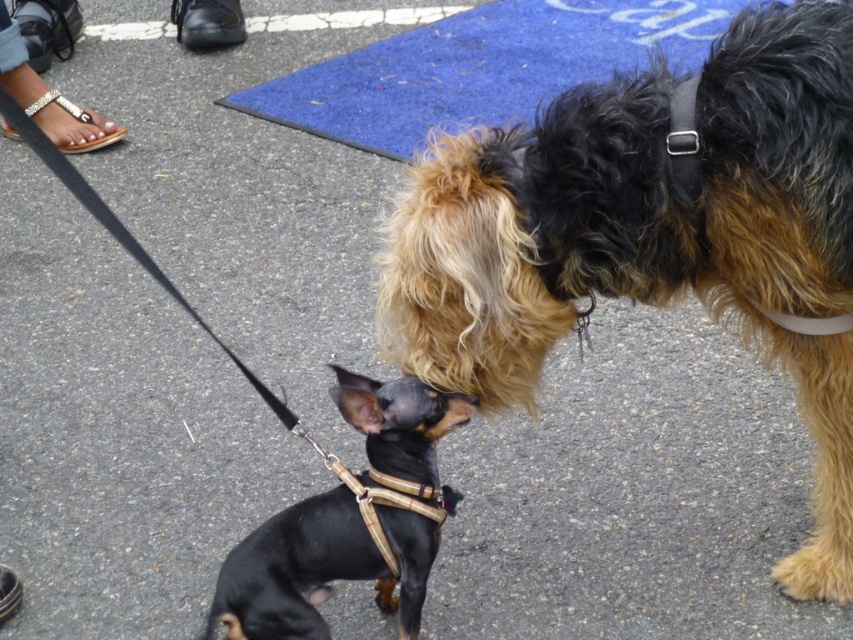
Can you confirm if black and tan fur at center is positioned above black leather harness at center?

Indeed, black and tan fur at center is positioned over black leather harness at center.

Which is more to the right, black and tan fur at center or black leather harness at center?

black and tan fur at center is more to the right.

Identify the location of black and tan fur at center. This screenshot has height=640, width=853. (650, 236).

What are the coordinates of `black and tan fur at center` in the screenshot? It's located at (650, 236).